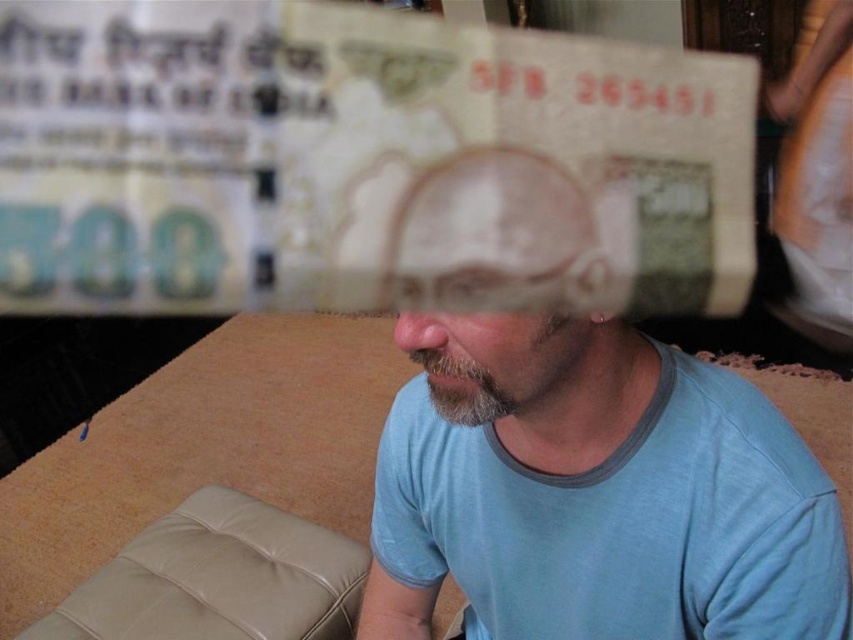
Can you confirm if light brown paper currency at upper center is shorter than matte paper currency at center?

Yes, light brown paper currency at upper center is shorter than matte paper currency at center.

What do you see at coordinates (363, 163) in the screenshot? The image size is (853, 640). I see `light brown paper currency at upper center` at bounding box center [363, 163].

Locate an element on the screen. This screenshot has width=853, height=640. light brown paper currency at upper center is located at coordinates (363, 163).